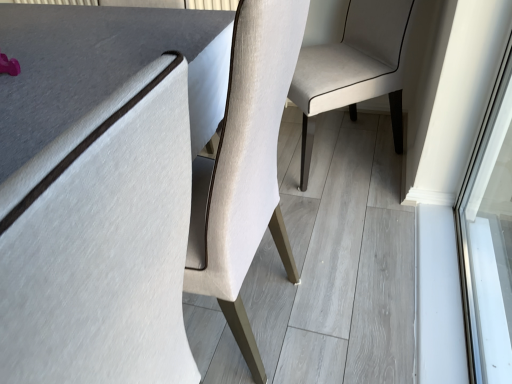
Question: Is matte gray table at center in front of or behind light beige fabric chair at center in the image?

Choices:
 (A) front
 (B) behind

Answer: (A)

Question: Considering the positions of matte gray table at center and light beige fabric chair at center in the image, is matte gray table at center wider or thinner than light beige fabric chair at center?

Choices:
 (A) wide
 (B) thin

Answer: (B)

Question: Visually, is matte gray table at center positioned to the left or to the right of light beige fabric chair at center?

Choices:
 (A) right
 (B) left

Answer: (B)

Question: Considering their positions, is light beige fabric chair at center located in front of or behind matte gray table at center?

Choices:
 (A) behind
 (B) front

Answer: (A)

Question: Is light beige fabric chair at center bigger or smaller than matte gray table at center?

Choices:
 (A) small
 (B) big

Answer: (B)

Question: Is light beige fabric chair at center wider or thinner than matte gray table at center?

Choices:
 (A) thin
 (B) wide

Answer: (B)

Question: In the image, is light beige fabric chair at center on the left side or the right side of matte gray table at center?

Choices:
 (A) left
 (B) right

Answer: (B)